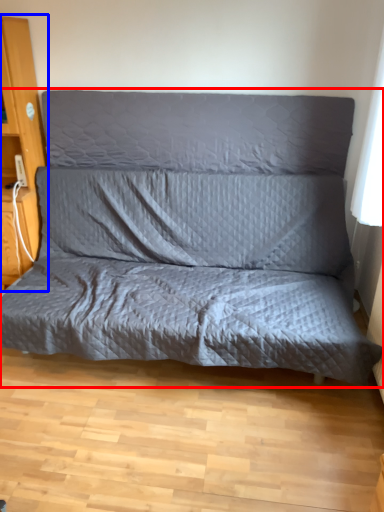
Question: Which of the following is the farthest to the observer, studio couch (highlighted by a red box) or dresser (highlighted by a blue box)?

Choices:
 (A) studio couch
 (B) dresser

Answer: (B)